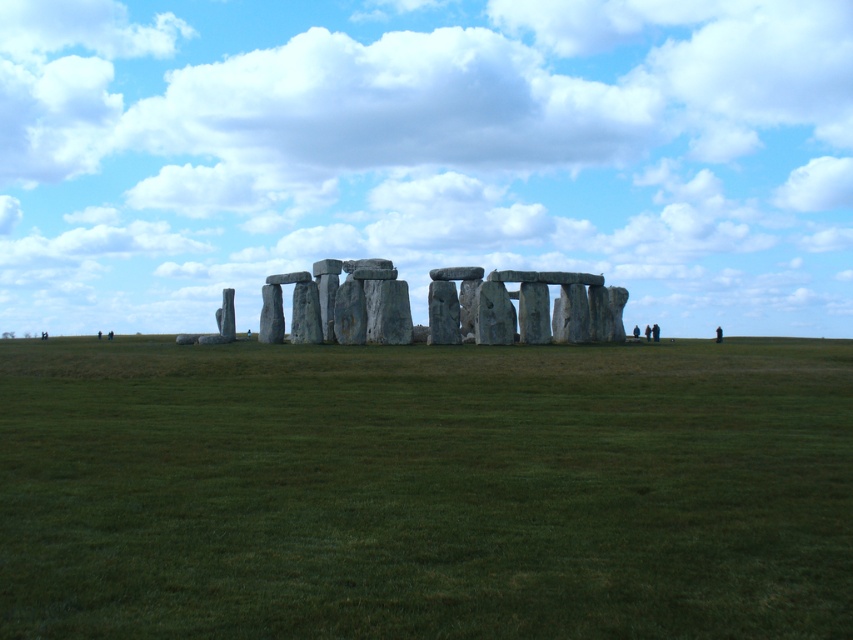
Question: Which of the following is the farthest from the observer?

Choices:
 (A) (346, 339)
 (B) (573, 456)

Answer: (A)

Question: In this image, where is green grassy field at center located relative to gray stone circle at center?

Choices:
 (A) right
 (B) left

Answer: (B)

Question: Is green grassy field at center wider than gray stone circle at center?

Choices:
 (A) no
 (B) yes

Answer: (B)

Question: Which point is farther from the camera taking this photo?

Choices:
 (A) (360, 353)
 (B) (268, 340)

Answer: (B)

Question: Can you confirm if green grassy field at center is positioned above gray stone circle at center?

Choices:
 (A) yes
 (B) no

Answer: (B)

Question: Which of the following is the farthest from the observer?

Choices:
 (A) (200, 436)
 (B) (608, 310)

Answer: (B)